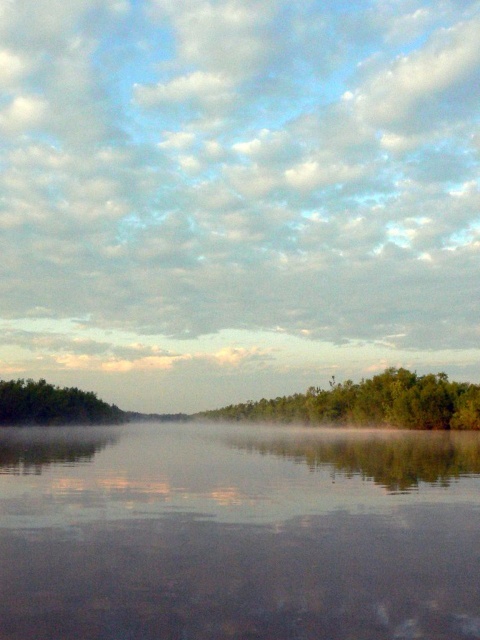
Does point (347, 406) come farther from viewer compared to point (72, 397)?

No.

What do you see at coordinates (371, 403) in the screenshot?
I see `green leafy trees at center` at bounding box center [371, 403].

Between point (430, 428) and point (51, 388), which one is positioned behind?

Point (51, 388)

I want to click on green leafy trees at center, so click(371, 403).

Is white misty fog at center below smooth reflective water at center?

Incorrect, white misty fog at center is not positioned below smooth reflective water at center.

Which is below, white misty fog at center or smooth reflective water at center?

Positioned lower is smooth reflective water at center.

Measure the distance between point (11, 150) and camera.

The distance of point (11, 150) from camera is 371.50 meters.

Where is `white misty fog at center`? The width and height of the screenshot is (480, 640). white misty fog at center is located at coordinates (237, 195).

Can you confirm if white misty fog at center is positioned to the right of green leafy tree at left?

Indeed, white misty fog at center is positioned on the right side of green leafy tree at left.

Which of these two, white misty fog at center or green leafy tree at left, stands shorter?

green leafy tree at left is shorter.

You are a GUI agent. You are given a task and a screenshot of the screen. Output one action in this format:
    pyautogui.click(x=<x>, y=<y>)
    Task: Click on the white misty fog at center
    Image resolution: width=480 pixels, height=640 pixels.
    Given the screenshot: What is the action you would take?
    pyautogui.click(x=237, y=195)